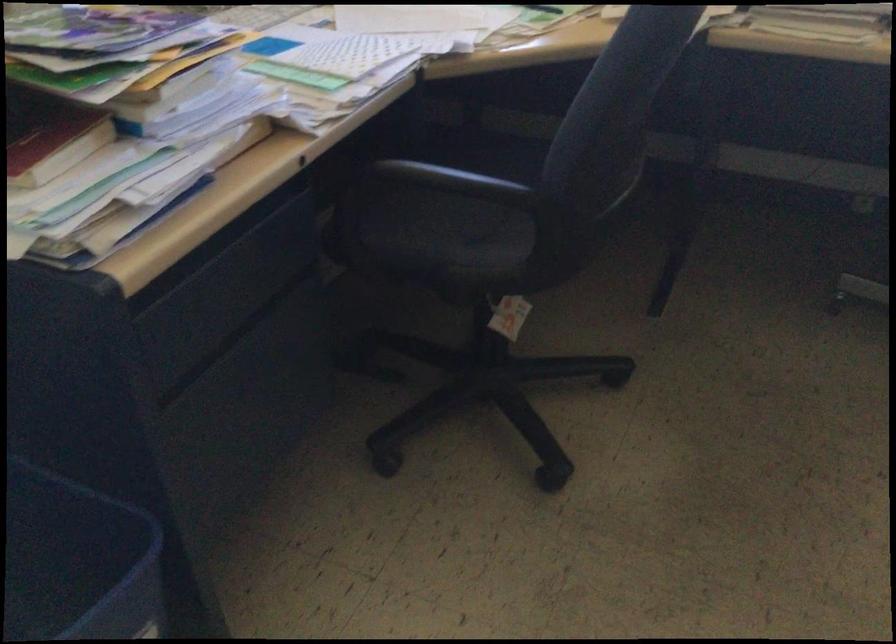
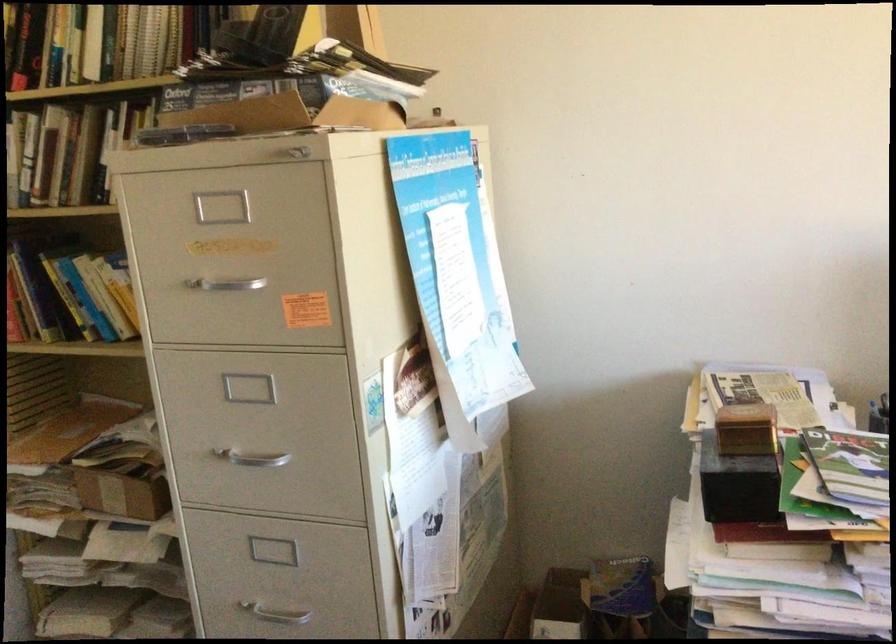
Question: The camera is either moving clockwise (left) or counter-clockwise (right) around the object. The first image is from the beginning of the video and the second image is from the end. Is the camera moving left or right when shooting the video?

Choices:
 (A) Left
 (B) Right

Answer: (B)